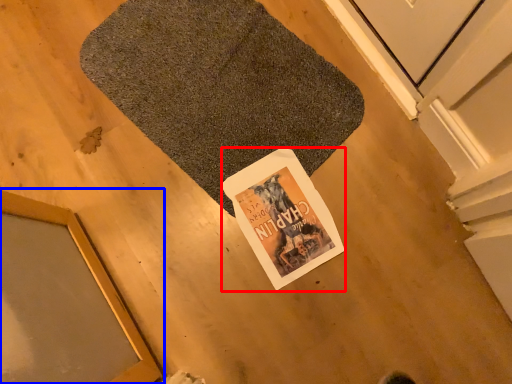
Question: Which of the following is the closest to the observer, magazine (highlighted by a red box) or window (highlighted by a blue box)?

Choices:
 (A) magazine
 (B) window

Answer: (B)